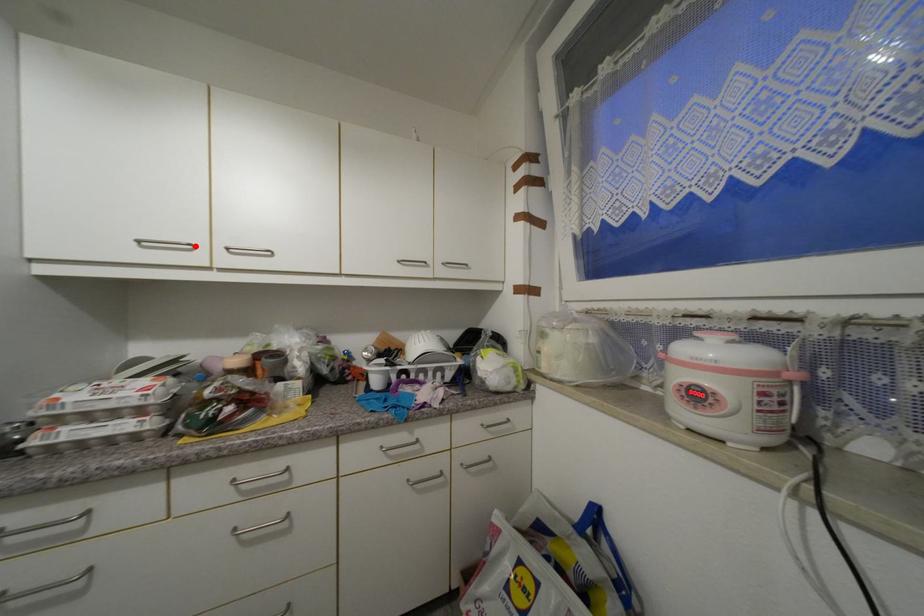
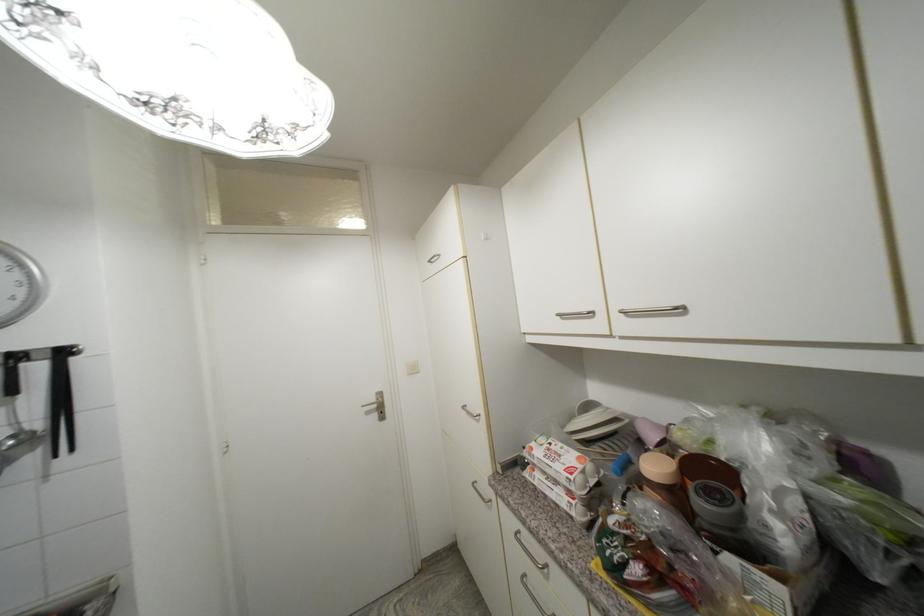
Where in the second image is the point corresponding to the highlighted location from the first image?

(594, 314)